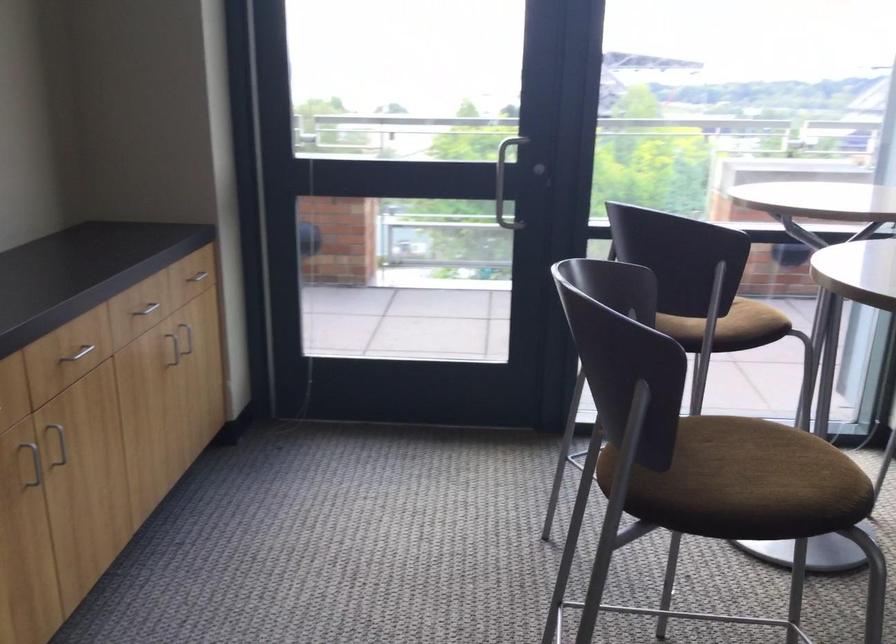
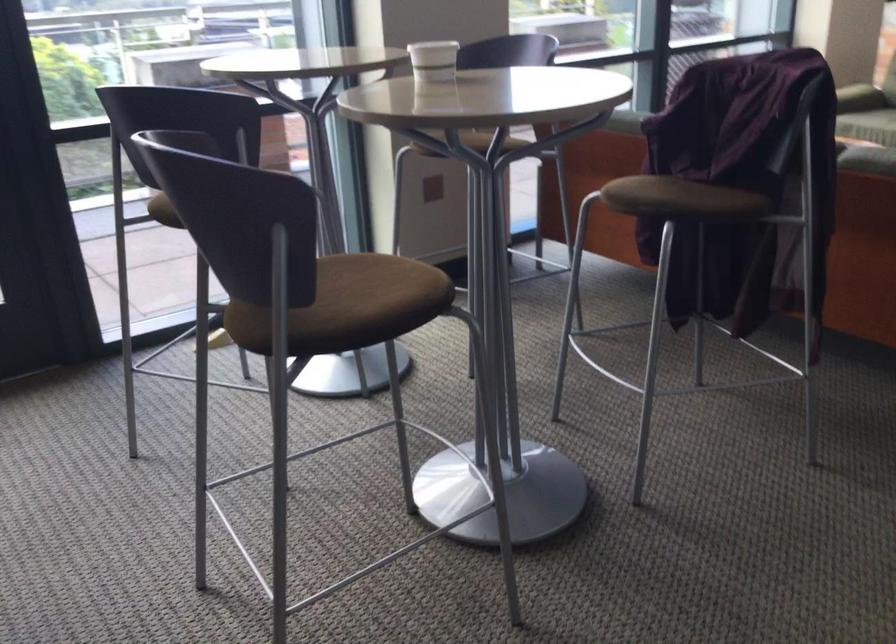
Locate, in the second image, the point that corresponds to the point at 755,469 in the first image.

(371, 292)